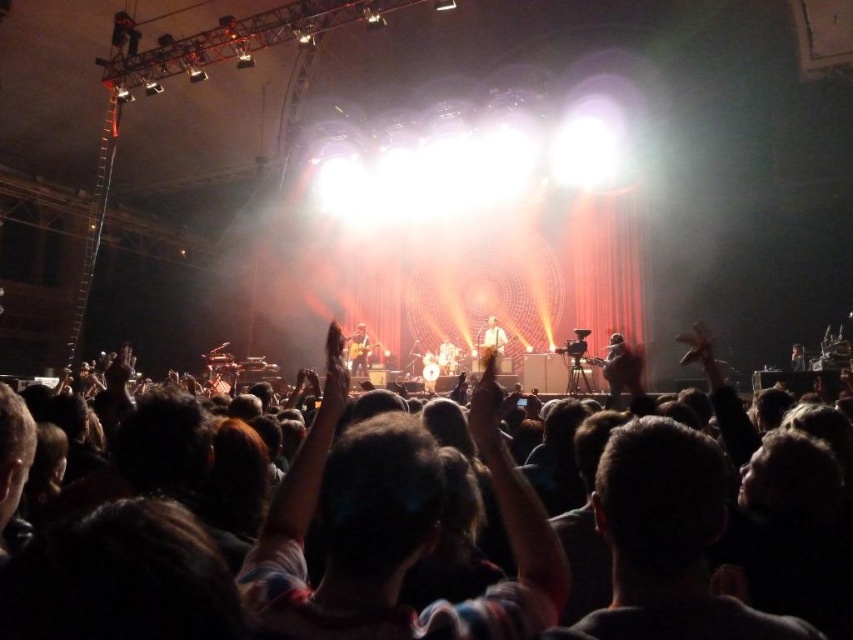
You are a photographer at the concert and want to capture both the light brown leather guitar at center and the matte black guitar at center in a single shot. Which guitar should you position to the left side of your camera frame to include both?

You should position the matte black guitar at center to the left side of your camera frame because the light brown leather guitar at center is already to the right of it.

Looking at this image, you are standing at the center of the stage and want to move towards the direction of the crowd. Which point, point (495, 321) or point (349, 356), is closer to the crowd?

Point (495, 321) is closer to the crowd because it is in front of point (349, 356).